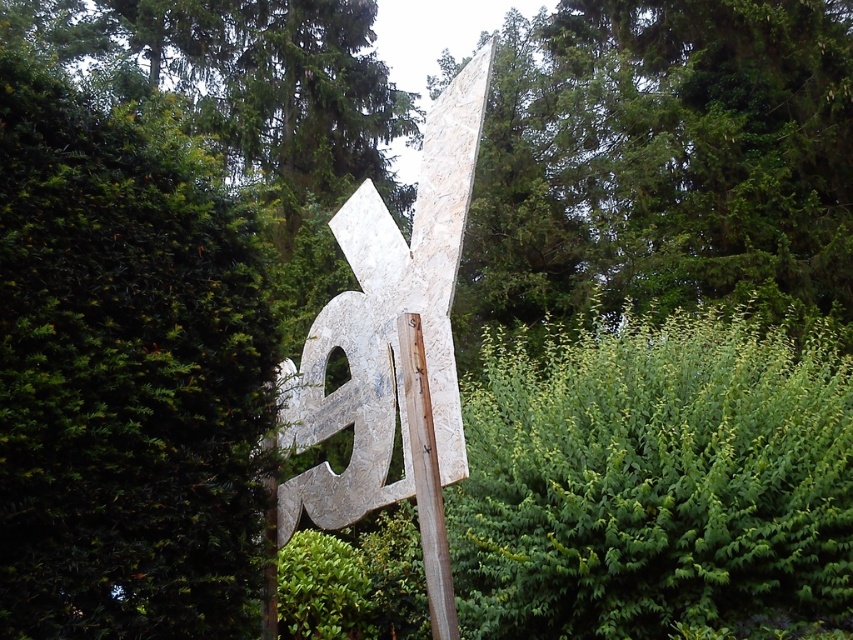
You are a maintenance worker inspecting the sculpture. You notice both the rusty metal sign at center and the wooden pole at center. Which object would you need to adjust if you want to ensure the smaller one is not obstructed by the larger one?

The rusty metal sign at center is larger than the wooden pole at center. To prevent the wooden pole at center from being obstructed, you should adjust the position of the rusty metal sign at center.

You are a maintenance worker needing to replace a sign. You have a new sign that is 5 feet wide. The rusty metal sign at center is currently attached to the wooden pole at center. Can the new sign fit on the same pole without overlapping the pole?

The distance between the rusty metal sign at center and the wooden pole at center is 6.22 feet. Since the new sign is 5 feet wide, it can fit on the pole without overlapping as there is enough space.

You are standing in front of the sculpture and want to take a photo of the wooden pole at center without the rusty metal sign at center blocking the view. Is this possible?

The wooden pole at center is behind the rusty metal sign at center, so you can take a photo of the wooden pole at center without the rusty metal sign at center blocking the view by moving to a position where the sign is out of frame or adjusting your angle so the pole is visible behind the sign.